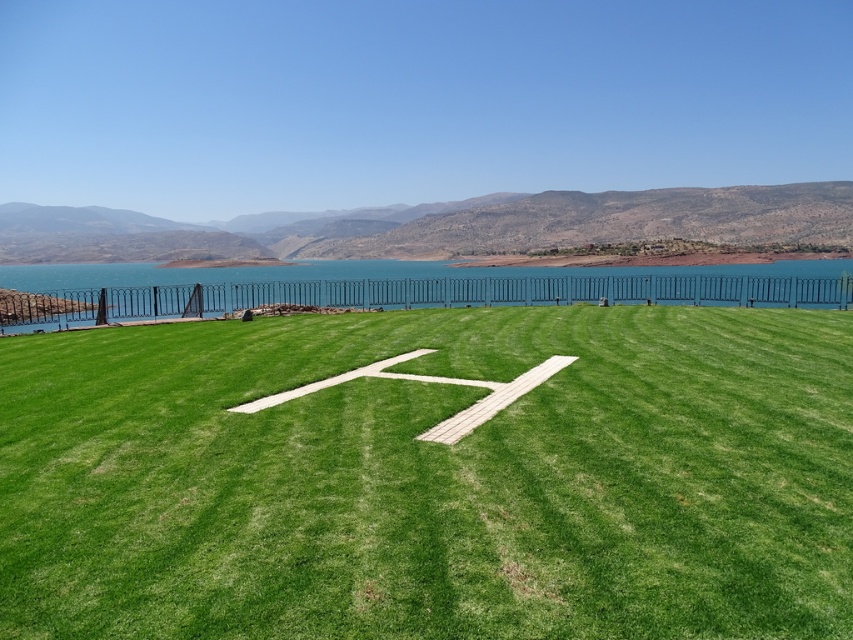
Question: Which point is closer to the camera?

Choices:
 (A) (838, 266)
 (B) (708, 609)

Answer: (B)

Question: Does green grass at center have a lesser width compared to blue water at upper center?

Choices:
 (A) yes
 (B) no

Answer: (A)

Question: Does green grass at center appear on the right side of blue water at upper center?

Choices:
 (A) no
 (B) yes

Answer: (B)

Question: Does green grass at center have a greater width compared to blue water at upper center?

Choices:
 (A) no
 (B) yes

Answer: (A)